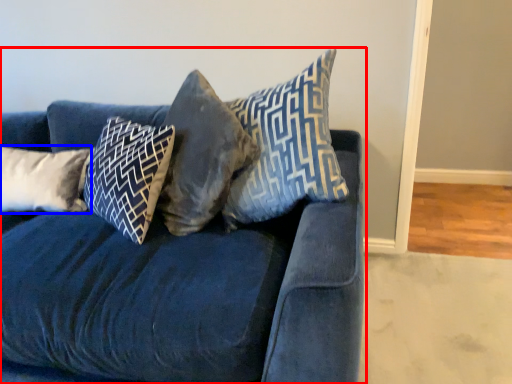
Question: Which of the following is the farthest to the observer, studio couch (highlighted by a red box) or pillow (highlighted by a blue box)?

Choices:
 (A) studio couch
 (B) pillow

Answer: (B)